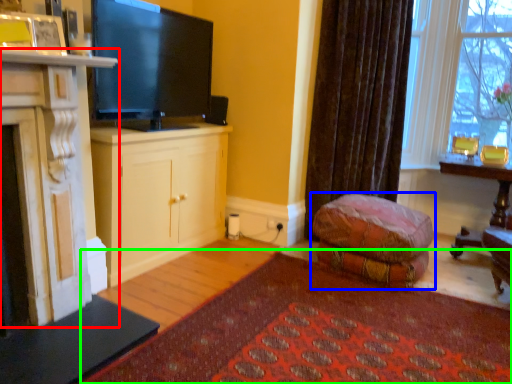
Question: Which is nearer to the cabinetry (highlighted by a red box)? studio couch (highlighted by a blue box) or plain (highlighted by a green box).

Choices:
 (A) studio couch
 (B) plain

Answer: (B)